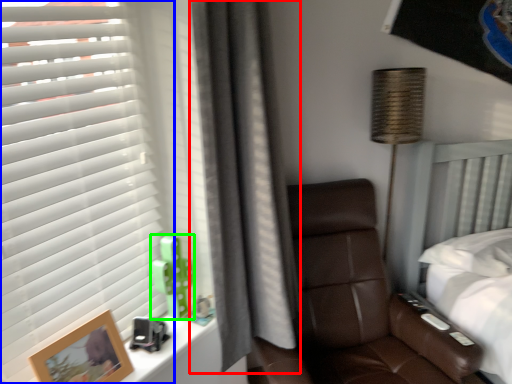
Question: Which object is the farthest from curtain (highlighted by a red box)? Choose among these: window blind (highlighted by a blue box) or toy (highlighted by a green box).

Choices:
 (A) window blind
 (B) toy

Answer: (A)